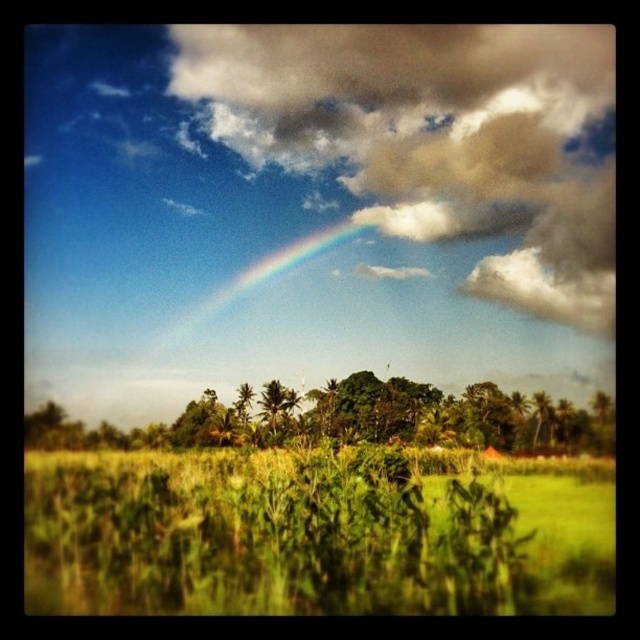
Question: Which of the following is the closest to the observer?

Choices:
 (A) (269, 388)
 (B) (257, 280)
 (C) (276, 428)
 (D) (204, 84)

Answer: (C)

Question: Is cloudy sky at upper center wider than rainbow at upper center?

Choices:
 (A) no
 (B) yes

Answer: (B)

Question: Based on their relative distances, which object is nearer to the cloudy sky at upper center?

Choices:
 (A) green leafy grass at lower center
 (B) rainbow at upper center
 (C) green leafy palm at center
 (D) green leafy trees at center

Answer: (B)

Question: Which object is farther from the camera taking this photo?

Choices:
 (A) rainbow at upper center
 (B) cloudy sky at upper center

Answer: (A)

Question: Is the position of rainbow at upper center less distant than that of green leafy palm at center?

Choices:
 (A) no
 (B) yes

Answer: (A)

Question: Can you confirm if green leafy grass at lower center is smaller than rainbow at upper center?

Choices:
 (A) no
 (B) yes

Answer: (A)